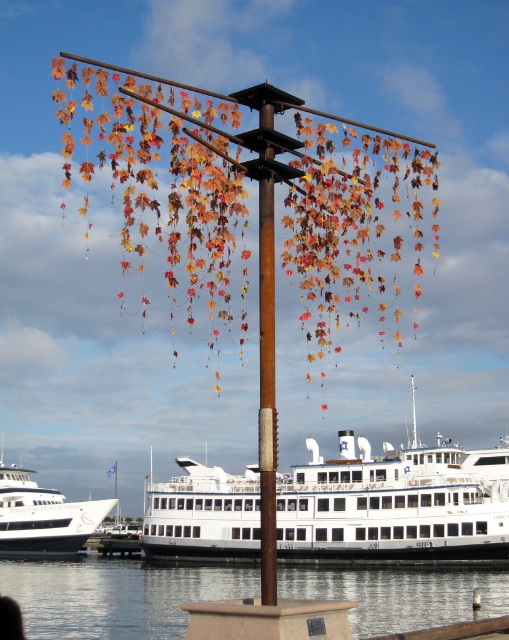
Question: Estimate the real-world distances between objects in this image. Which object is farther from the white matte ferry at center?

Choices:
 (A) transparent glass water at lower center
 (B) white glossy ferry at lower left

Answer: (B)

Question: Which object appears farthest from the camera in this image?

Choices:
 (A) white glossy ferry at lower left
 (B) white matte ferry at center

Answer: (A)

Question: Is white matte ferry at center to the left of transparent glass water at lower center from the viewer's perspective?

Choices:
 (A) yes
 (B) no

Answer: (B)

Question: Which of the following is the farthest from the observer?

Choices:
 (A) white glossy ferry at lower left
 (B) transparent glass water at lower center
 (C) white matte ferry at center

Answer: (A)

Question: Is white matte ferry at center wider than transparent glass water at lower center?

Choices:
 (A) no
 (B) yes

Answer: (A)

Question: Does white matte ferry at center have a smaller size compared to white glossy ferry at lower left?

Choices:
 (A) no
 (B) yes

Answer: (A)